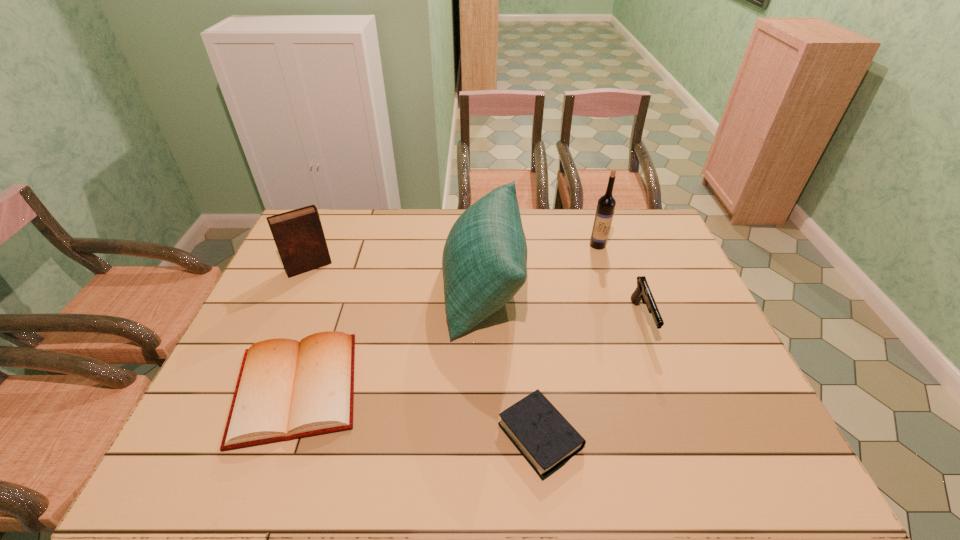
At what (x,y) coordinates should I click in order to perform the action: click on vacant region that satisfies the following two spatial constraints: 1. on the front-facing side of the cushion; 2. on the back side of the rightmost Bible. Please return your answer as a coordinate pair (x, y). The height and width of the screenshot is (540, 960). Looking at the image, I should click on (486, 436).

I want to click on vacant space that satisfies the following two spatial constraints: 1. on the label of the wine bottle; 2. on the front-facing side of the cushion, so click(x=612, y=287).

Locate an element on the screen. The height and width of the screenshot is (540, 960). free space that satisfies the following two spatial constraints: 1. on the front-facing side of the cushion; 2. on the right side of the rightmost Bible is located at coordinates (486, 436).

Find the location of a particular element. free space that satisfies the following two spatial constraints: 1. on the front-facing side of the cushion; 2. on the right side of the rightmost Bible is located at coordinates (486, 436).